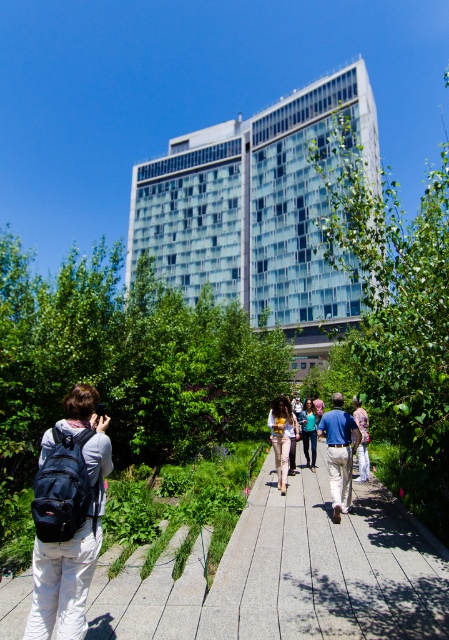
You are a photographer trying to capture a person wearing blue denim clothing in the park. You notice the blue denim jacket at center and the blue denim jeans at center. Which item of clothing is positioned higher on the person?

The blue denim jacket at center is taller than the blue denim jeans at center, so the jacket is positioned higher on the person.

You are standing at the entrance of the modern glass building and see the gray concrete pavement at center and the matte black backpack at lower left. Which object is closer to you?

The gray concrete pavement at center is closer to you because it is further to the viewer than the matte black backpack at lower left.